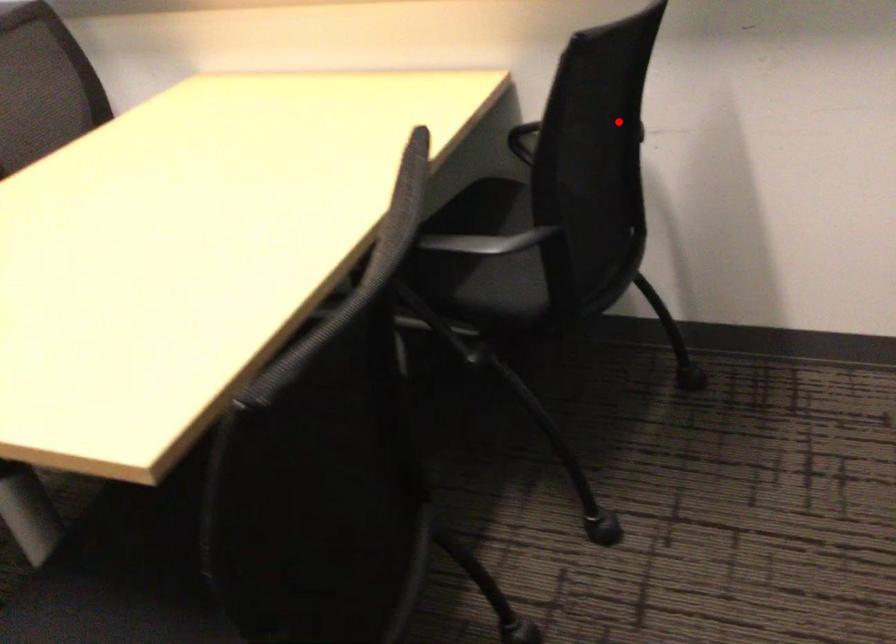
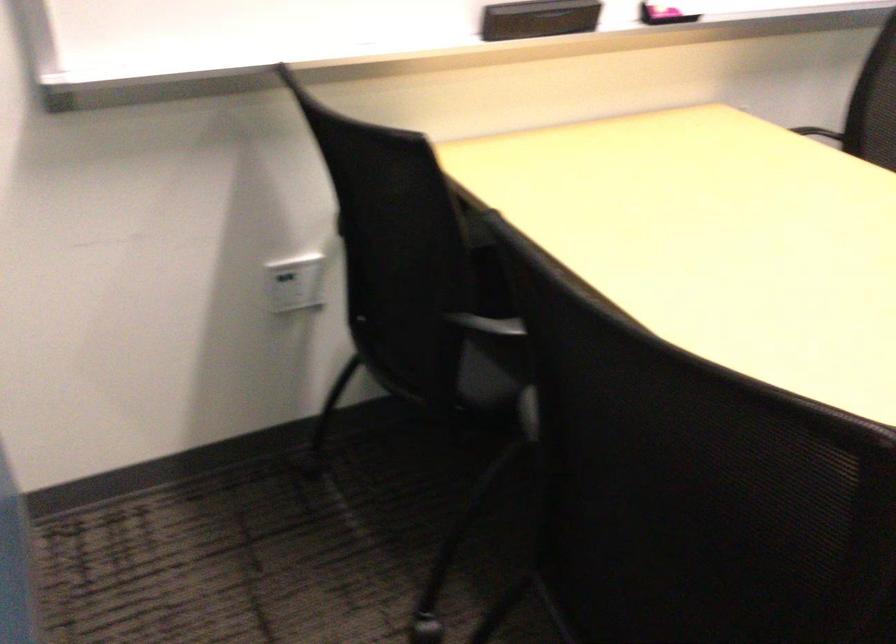
Question: I am providing you with two images of the same scene from different viewpoints. Given a red point in image1, look at the same physical point in image2. Is it:

Choices:
 (A) Closer to the viewpoint
 (B) Farther from the viewpoint

Answer: (B)